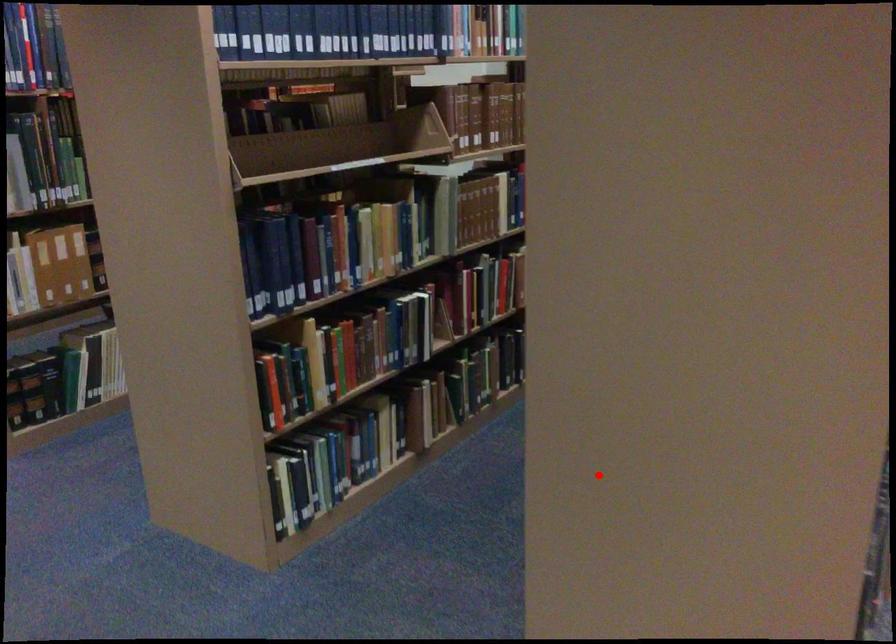
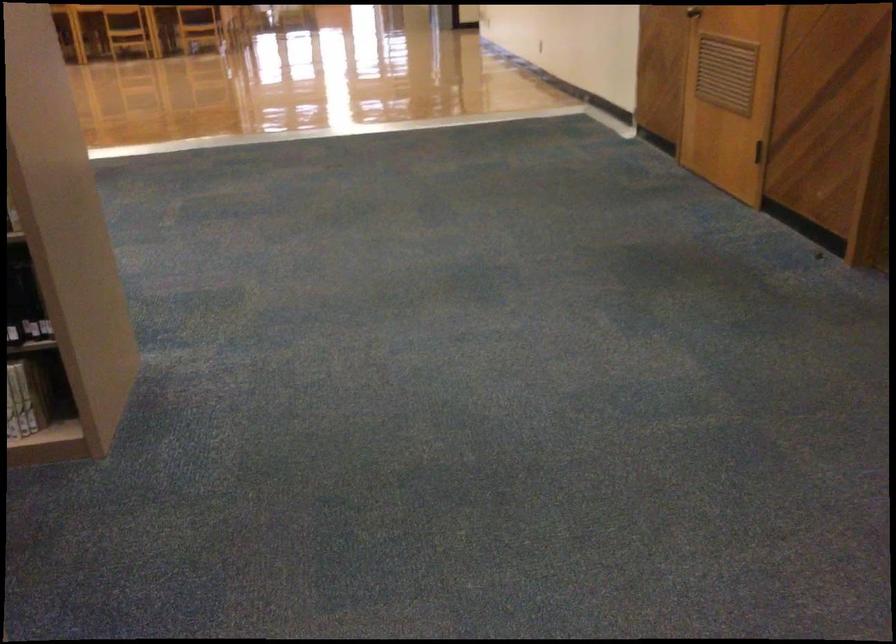
Question: I am providing you with two images of the same scene from different viewpoints. A red point is shown in image1. For the corresponding object point in image2, is it positioned nearer or farther from the camera?

Choices:
 (A) Nearer
 (B) Farther

Answer: (B)